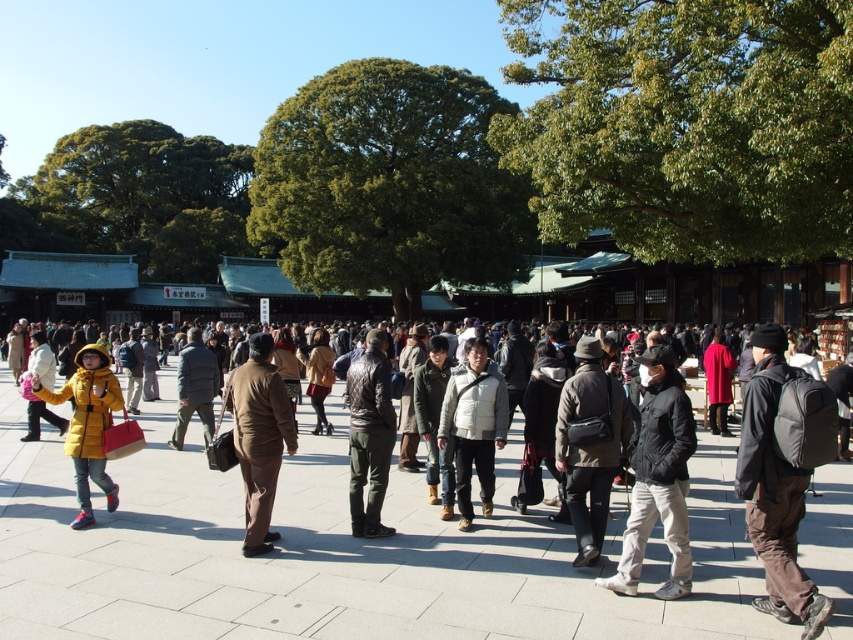
Does matte black crowd at center appear over black matte jacket at center?

No, matte black crowd at center is not above black matte jacket at center.

Is the position of matte black crowd at center less distant than that of black matte jacket at center?

Yes, it is.

Who is more distant from viewer, (492, 577) or (636, 573)?

Point (492, 577)

The width and height of the screenshot is (853, 640). Find the location of `matte black crowd at center`. matte black crowd at center is located at coordinates (339, 552).

In the scene shown: Which is above, leather jacket at center or light brown leather jacket at center?

leather jacket at center is above.

Between leather jacket at center and light brown leather jacket at center, which one has more height?

Standing taller between the two is leather jacket at center.

Locate an element on the screen. The width and height of the screenshot is (853, 640). leather jacket at center is located at coordinates (369, 435).

Identify the location of leather jacket at center. (369, 435).

Does black matte jacket at center have a smaller size compared to white down jacket at center?

Yes.

Can you confirm if black matte jacket at center is positioned below white down jacket at center?

No.

Does point (671, 381) lie behind point (459, 497)?

No, (671, 381) is in front of (459, 497).

This screenshot has width=853, height=640. I want to click on black matte jacket at center, so click(x=659, y=477).